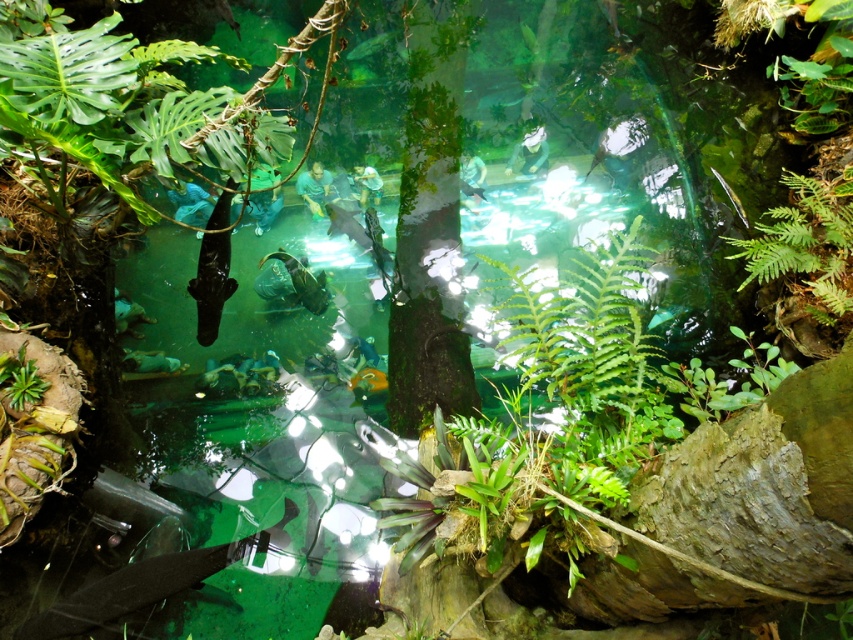
Question: Does green textured tree at center have a greater width compared to shiny black fish at center-left?

Choices:
 (A) no
 (B) yes

Answer: (B)

Question: Is green textured tree at center wider than shiny black fish at center-left?

Choices:
 (A) no
 (B) yes

Answer: (B)

Question: Is green textured tree at center smaller than shiny black fish at center-left?

Choices:
 (A) no
 (B) yes

Answer: (A)

Question: Based on their relative distances, which object is nearer to the shiny black fish at center-left?

Choices:
 (A) green textured tree at center
 (B) green translucent fish at center

Answer: (A)

Question: Which object appears farthest from the camera in this image?

Choices:
 (A) green translucent fish at center
 (B) shiny black fish at center-left
 (C) green textured tree at center

Answer: (A)

Question: Which of the following is the farthest from the observer?

Choices:
 (A) (204, 262)
 (B) (370, 51)
 (C) (403, 269)

Answer: (B)